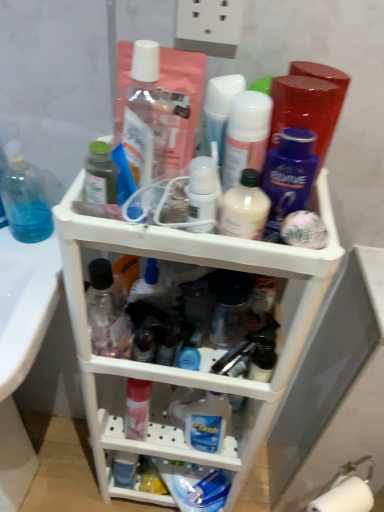
Question: Should I look upward or downward to see white glossy bottle at upper center, which appears as the fourth toiletry when viewed from the left?

Choices:
 (A) down
 (B) up

Answer: (B)

Question: Can you confirm if matte white lotion at center, the sixth toiletry in the left-to-right sequence, is wider than transparent plastic hand soap at left?

Choices:
 (A) no
 (B) yes

Answer: (A)

Question: Is transparent plastic hand soap at left located within matte white lotion at center, the third toiletry when ordered from right to left?

Choices:
 (A) no
 (B) yes

Answer: (A)

Question: From a real-world perspective, is matte white lotion at center, the third toiletry when ordered from right to left, on top of transparent plastic hand soap at left?

Choices:
 (A) yes
 (B) no

Answer: (A)

Question: Considering the relative sizes of matte white lotion at center, the sixth toiletry in the left-to-right sequence, and transparent plastic hand soap at left in the image provided, is matte white lotion at center, the sixth toiletry in the left-to-right sequence, shorter than transparent plastic hand soap at left?

Choices:
 (A) no
 (B) yes

Answer: (A)

Question: Is matte white lotion at center, the sixth toiletry in the left-to-right sequence, taller than transparent plastic hand soap at left?

Choices:
 (A) yes
 (B) no

Answer: (A)

Question: From the image's perspective, is matte white lotion at center, the third toiletry when ordered from right to left, on transparent plastic hand soap at left?

Choices:
 (A) yes
 (B) no

Answer: (A)

Question: Is transparent plastic bottle at center, acting as the first toiletry starting from the left, not near transparent plastic hand soap at left?

Choices:
 (A) yes
 (B) no

Answer: (B)

Question: Is transparent plastic bottle at center, acting as the first toiletry starting from the left, completely or partially outside of transparent plastic hand soap at left?

Choices:
 (A) yes
 (B) no

Answer: (A)

Question: Can you confirm if transparent plastic bottle at center, which is the 8th toiletry in right-to-left order, is shorter than transparent plastic hand soap at left?

Choices:
 (A) no
 (B) yes

Answer: (A)

Question: Could you tell me if transparent plastic bottle at center, acting as the first toiletry starting from the left, is facing transparent plastic hand soap at left?

Choices:
 (A) yes
 (B) no

Answer: (B)

Question: Can you confirm if transparent plastic bottle at center, which is the 8th toiletry in right-to-left order, is bigger than transparent plastic hand soap at left?

Choices:
 (A) yes
 (B) no

Answer: (A)

Question: Is transparent plastic bottle at center, acting as the first toiletry starting from the left, taller than transparent plastic hand soap at left?

Choices:
 (A) yes
 (B) no

Answer: (A)

Question: Would you say white plastic shelf at center contains transparent plastic bottle at center, which is the 8th toiletry in right-to-left order?

Choices:
 (A) no
 (B) yes

Answer: (B)